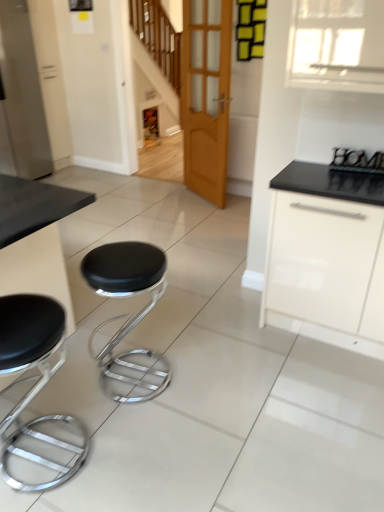
You are a GUI agent. You are given a task and a screenshot of the screen. Output one action in this format:
    pyautogui.click(x=<x>, y=<y>)
    Task: Click on the white glossy cabinet at right
    This screenshot has width=384, height=512.
    Given the screenshot: What is the action you would take?
    pyautogui.click(x=326, y=257)

What do you see at coordinates (36, 382) in the screenshot? I see `black leather stool at lower left, the 1th stool positioned from the left` at bounding box center [36, 382].

The height and width of the screenshot is (512, 384). What do you see at coordinates (206, 95) in the screenshot? I see `wooden door at center` at bounding box center [206, 95].

Image resolution: width=384 pixels, height=512 pixels. In order to click on metallic black sign at upper right, positioned as the 2th appliance in back-to-front order in this screenshot , I will do `click(357, 161)`.

Identify the location of black leather stool at center, which is the second stool from left to right. The width and height of the screenshot is (384, 512). coord(127,314).

Find the location of a particular element. satin white refrigerator at left, which ranks as the 2th appliance in right-to-left order is located at coordinates (21, 98).

Locate an element on the screen. Image resolution: width=384 pixels, height=512 pixels. white glossy cabinet at right is located at coordinates (326, 257).

From the image's perspective, is wooden door at center under white glossy cabinet at right?

No.

Is wooden door at center positioned far away from white glossy cabinet at right?

Absolutely, wooden door at center is distant from white glossy cabinet at right.

Does wooden door at center appear on the left side of white glossy cabinet at right?

Correct, you'll find wooden door at center to the left of white glossy cabinet at right.

Considering the sizes of wooden door at center and white glossy cabinet at right in the image, is wooden door at center taller or shorter than white glossy cabinet at right?

Clearly, wooden door at center is taller compared to white glossy cabinet at right.

From a real-world perspective, between satin white refrigerator at left, which is counted as the first appliance, starting from the left, and black leather stool at center, which is the second stool from left to right, who is vertically higher?

From a 3D spatial view, satin white refrigerator at left, which is counted as the first appliance, starting from the left, is above.

Is satin white refrigerator at left, which ranks as the first appliance in back-to-front order, looking in the opposite direction of black leather stool at center, which is the second stool from left to right?

That's not correct — satin white refrigerator at left, which ranks as the first appliance in back-to-front order, is not looking away from black leather stool at center, which is the second stool from left to right.

Is satin white refrigerator at left, which ranks as the 2th appliance in right-to-left order, positioned behind black leather stool at center, which is the second stool from left to right?

Yes, satin white refrigerator at left, which ranks as the 2th appliance in right-to-left order, is further from the viewer.

Is point (2, 35) positioned behind point (111, 368)?

Yes, point (2, 35) is farther from viewer.

Is satin white refrigerator at left, which is counted as the first appliance, starting from the left, taller or shorter than black leather stool at lower left, the 1th stool positioned from the left?

In the image, satin white refrigerator at left, which is counted as the first appliance, starting from the left, appears to be taller than black leather stool at lower left, the 1th stool positioned from the left.

Which is more to the right, satin white refrigerator at left, which ranks as the 2th appliance in right-to-left order, or black leather stool at lower left, the 2th stool from the right?

black leather stool at lower left, the 2th stool from the right.

From the black leather stool at lower left, the 2th stool from the right, count 2nd appliances backward and point to it. Please provide its 2D coordinates.

[(21, 98)]

From a real-world perspective, which is physically above, satin white refrigerator at left, placed as the 2th appliance when sorted from bottom to top, or black leather stool at lower left, the 2th stool from the right?

From a 3D spatial view, satin white refrigerator at left, placed as the 2th appliance when sorted from bottom to top, is above.

In the scene shown: Which is farther from the camera, (205, 70) or (6, 448)?

The point (205, 70) is more distant.

Based on the photo, which of these two, wooden door at center or black leather stool at lower left, the 2th stool from the right, is wider?

black leather stool at lower left, the 2th stool from the right.

Is wooden door at center not close to black leather stool at lower left, the 1th stool positioned from the left?

wooden door at center is positioned a significant distance from black leather stool at lower left, the 1th stool positioned from the left.

Is wooden door at center at the left side of black leather stool at lower left, the 2th stool from the right?

No, wooden door at center is not to the left of black leather stool at lower left, the 2th stool from the right.

Is black leather stool at lower left, the 2th stool from the right, placed right next to white glossy cabinet at right?

No, black leather stool at lower left, the 2th stool from the right, is not in contact with white glossy cabinet at right.

From a real-world perspective, which is physically below, black leather stool at lower left, the 2th stool from the right, or white glossy cabinet at right?

black leather stool at lower left, the 2th stool from the right.

Looking at their sizes, would you say black leather stool at lower left, the 1th stool positioned from the left, is wider or thinner than white glossy cabinet at right?

In the image, black leather stool at lower left, the 1th stool positioned from the left, appears to be more narrow than white glossy cabinet at right.

Is black leather stool at lower left, the 1th stool positioned from the left, to the left or to the right of white glossy cabinet at right in the image?

black leather stool at lower left, the 1th stool positioned from the left, is to the left of white glossy cabinet at right.

Would you say wooden door at center is outside satin white refrigerator at left, the second appliance positioned from the front?

That's correct, wooden door at center is outside of satin white refrigerator at left, the second appliance positioned from the front.

From the image's perspective, which is below, wooden door at center or satin white refrigerator at left, which is the 1th appliance in top-to-bottom order?

wooden door at center.

What's the angular difference between wooden door at center and satin white refrigerator at left, which is counted as the first appliance, starting from the left,'s facing directions?

119 degrees.

Between wooden door at center and black leather stool at center, which appears as the first stool when viewed from the right, which one has smaller size?

With smaller size is wooden door at center.

Would you say wooden door at center is a long distance from black leather stool at center, which is the second stool from left to right?

Yes, wooden door at center and black leather stool at center, which is the second stool from left to right, are quite far apart.

Locate an element on the screen. The image size is (384, 512). door that appears on the left of white glossy cabinet at right is located at coordinates (206, 95).

The image size is (384, 512). I want to click on stool that is the 1st one when counting forward from the satin white refrigerator at left, placed as the 2th appliance when sorted from bottom to top, so click(127, 314).

Looking at the image, which one is located closer to wooden door at center, metallic black sign at upper right, which is the 2th appliance from left to right, or black leather stool at center, which is the second stool from left to right?

Among the two, metallic black sign at upper right, which is the 2th appliance from left to right, is located nearer to wooden door at center.

Considering their positions, is black leather stool at center, which is the second stool from left to right, positioned closer to white glossy cabinet at right than satin white refrigerator at left, which is the 1th appliance in top-to-bottom order?

Based on the image, black leather stool at center, which is the second stool from left to right, appears to be nearer to white glossy cabinet at right.

In the scene shown: Which object lies nearer to the anchor point satin white refrigerator at left, which is the 1th appliance in top-to-bottom order, wooden door at center or black leather stool at lower left, the 1th stool positioned from the left?

Based on the image, wooden door at center appears to be nearer to satin white refrigerator at left, which is the 1th appliance in top-to-bottom order.

Which object lies nearer to the anchor point black leather stool at lower left, the 1th stool positioned from the left, white glossy cabinet at right or satin white refrigerator at left, which ranks as the first appliance in back-to-front order?

white glossy cabinet at right is positioned closer to the anchor black leather stool at lower left, the 1th stool positioned from the left.

Which object lies further to the anchor point satin white refrigerator at left, which ranks as the first appliance in back-to-front order, white glossy cabinet at right or black leather stool at lower left, the 2th stool from the right?

white glossy cabinet at right lies further to satin white refrigerator at left, which ranks as the first appliance in back-to-front order, than the other object.

Based on their spatial positions, is black leather stool at center, which is the second stool from left to right, or metallic black sign at upper right, which is the first appliance in front-to-back order, closer to white glossy cabinet at right?

metallic black sign at upper right, which is the first appliance in front-to-back order, is closer to white glossy cabinet at right.

Which object lies nearer to the anchor point satin white refrigerator at left, placed as the 2th appliance when sorted from bottom to top, white glossy cabinet at right or black leather stool at center, which is the second stool from left to right?

black leather stool at center, which is the second stool from left to right, is closer to satin white refrigerator at left, placed as the 2th appliance when sorted from bottom to top.

Looking at this image, considering their positions, is black leather stool at lower left, the 1th stool positioned from the left, positioned further to black leather stool at center, which appears as the first stool when viewed from the right, than wooden door at center?

Based on the image, wooden door at center appears to be further to black leather stool at center, which appears as the first stool when viewed from the right.

Where is `door between satin white refrigerator at left, the second appliance positioned from the front, and metallic black sign at upper right, which ranks as the first appliance in bottom-to-top order, from left to right`? door between satin white refrigerator at left, the second appliance positioned from the front, and metallic black sign at upper right, which ranks as the first appliance in bottom-to-top order, from left to right is located at coordinates 206,95.

I want to click on door between black leather stool at lower left, the 1th stool positioned from the left, and satin white refrigerator at left, which ranks as the 2th appliance in right-to-left order, along the z-axis, so click(x=206, y=95).

What are the coordinates of `stool between black leather stool at lower left, the 2th stool from the right, and metallic black sign at upper right, which is the 2th appliance from left to right` in the screenshot? It's located at (127, 314).

Locate an element on the screen. cabinetry positioned between black leather stool at lower left, the 2th stool from the right, and wooden door at center from near to far is located at coordinates (326, 257).